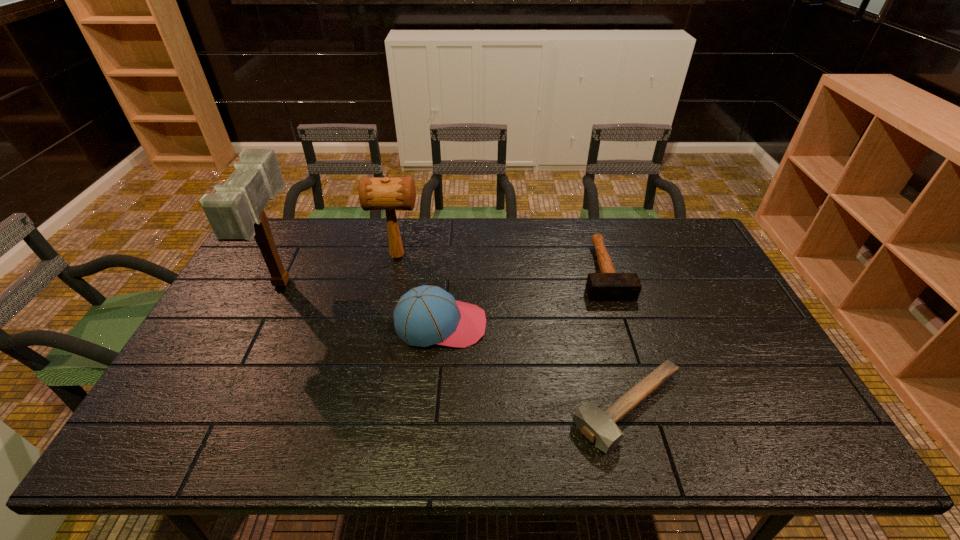
At what (x,y) coordinates should I click in order to perform the action: click on the third closest object to the second shortest object. Please return your answer as a coordinate pair (x, y). The width and height of the screenshot is (960, 540). Looking at the image, I should click on (389, 194).

Select which object is the second closest to the third shortest object. Please provide its 2D coordinates. Your answer should be formatted as a tuple, i.e. [(x, y)], where the tuple contains the x and y coordinates of a point satisfying the conditions above.

[(599, 427)]

Point out which mallet is positioned as the nearest to the second shortest mallet. Please provide its 2D coordinates. Your answer should be formatted as a tuple, i.e. [(x, y)], where the tuple contains the x and y coordinates of a point satisfying the conditions above.

[(599, 427)]

Identify the location of the third closest mallet relative to the fourth tallest object. This screenshot has height=540, width=960. (235, 212).

At what (x,y) coordinates should I click in order to perform the action: click on vacant space that satisfies the following two spatial constraints: 1. on the front-facing side of the nearest object; 2. on the right side of the baseball cap. Please return your answer as a coordinate pair (x, y). Looking at the image, I should click on (433, 408).

The width and height of the screenshot is (960, 540). I want to click on vacant space that satisfies the following two spatial constraints: 1. on the front-facing side of the nearest mallet; 2. on the right side of the baseball cap, so click(433, 408).

Identify the location of free space in the image that satisfies the following two spatial constraints: 1. on the back side of the nearest mallet; 2. on the strike surface of the second tallest mallet. (586, 256).

Find the location of a particular element. vacant space that satisfies the following two spatial constraints: 1. on the front-facing side of the shortest object; 2. on the left side of the third shortest object is located at coordinates (433, 408).

Identify the location of vacant space that satisfies the following two spatial constraints: 1. on the front-facing side of the baseball cap; 2. on the right side of the shortest object. This screenshot has height=540, width=960. (433, 408).